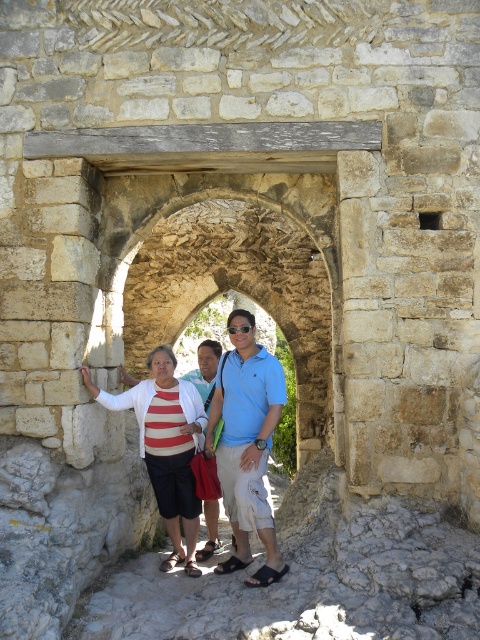
Between striped fabric sweater at center and blue cotton polo shirt at center, which one appears on the left side from the viewer's perspective?

striped fabric sweater at center

Describe the element at coordinates (224, 433) in the screenshot. I see `striped fabric sweater at center` at that location.

The height and width of the screenshot is (640, 480). I want to click on striped fabric sweater at center, so click(224, 433).